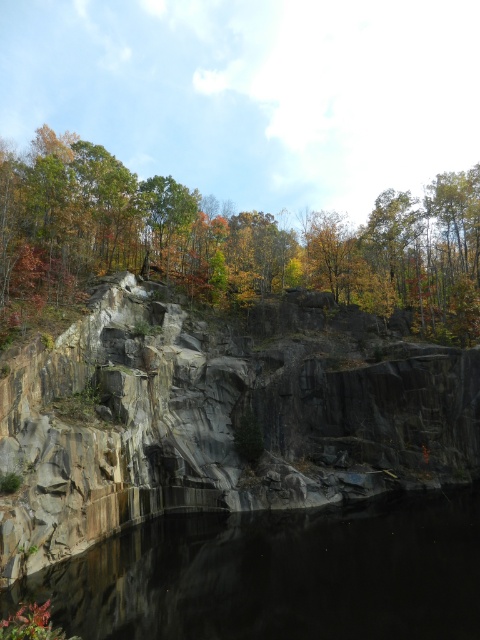
Can you confirm if gray/rocky cliff at center is shorter than green matte tree at upper center?

Correct, gray/rocky cliff at center is not as tall as green matte tree at upper center.

Is point (350, 324) farther from viewer compared to point (374, 268)?

No, (350, 324) is closer to viewer.

Does point (155, 420) come in front of point (192, 250)?

Yes, it is in front of point (192, 250).

Identify the location of gray/rocky cliff at center. This screenshot has width=480, height=640. (218, 419).